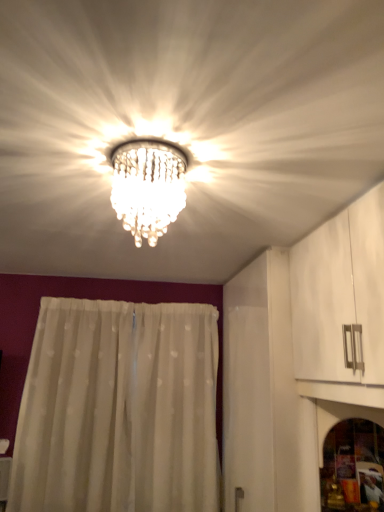
Question: In terms of size, does transparent glass screen door at lower right appear bigger or smaller than white sheer curtain at center?

Choices:
 (A) big
 (B) small

Answer: (B)

Question: Considering their positions, is transparent glass screen door at lower right located in front of or behind white sheer curtain at center?

Choices:
 (A) front
 (B) behind

Answer: (A)

Question: Estimate the real-world distances between objects in this image. Which object is closer to the clear crystal chandelier at center?

Choices:
 (A) white sheer curtain at center
 (B) transparent glass screen door at lower right

Answer: (B)

Question: Based on their relative distances, which object is nearer to the white sheer curtain at center?

Choices:
 (A) clear crystal chandelier at center
 (B) transparent glass screen door at lower right

Answer: (B)